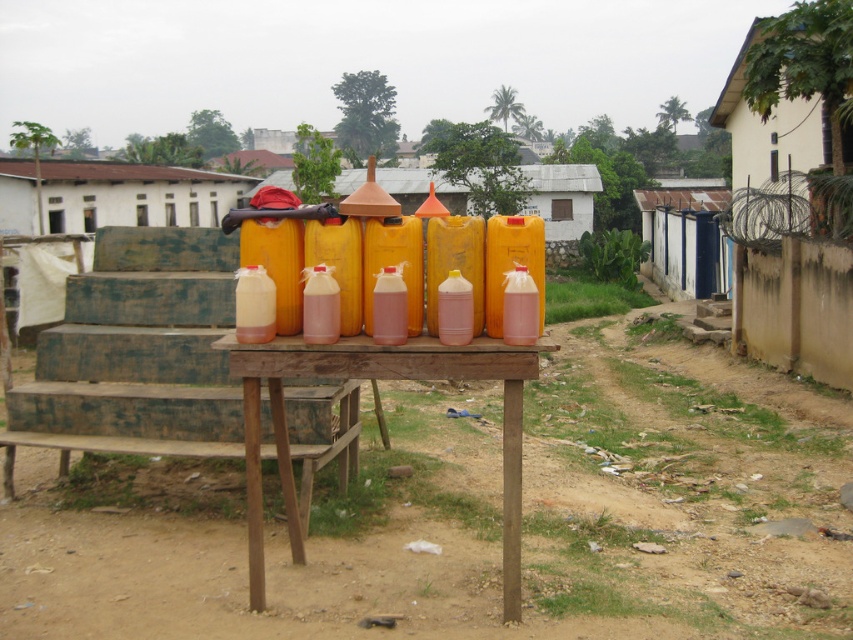
You are standing at the edge of the dirt field at lower center and want to reach the wooden table at center. Which direction should you move to get there?

The wooden table at center is behind the dirt field at lower center, so you should move forward towards the wooden table at center.

You are standing at the edge of the dirt field at lower center and want to reach the wooden table at center to get a drink from one of the jerry cans. Which direction should you walk to get there?

The dirt field at lower center is positioned on the left side of wooden table at center, so you should walk to the right to reach the wooden table at center from the dirt field at lower center.